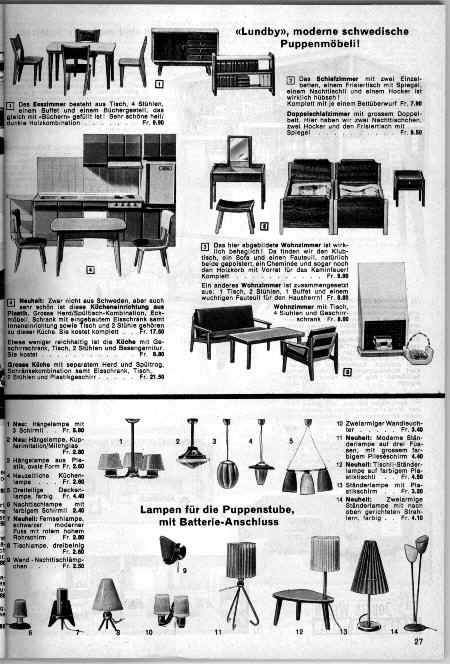
I want to click on mirror, so click(235, 153).